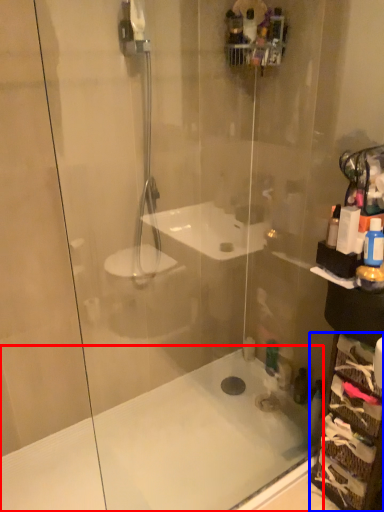
Question: Which object appears farthest to the camera in this image, bath (highlighted by a red box) or glass box (highlighted by a blue box)?

Choices:
 (A) bath
 (B) glass box

Answer: (B)